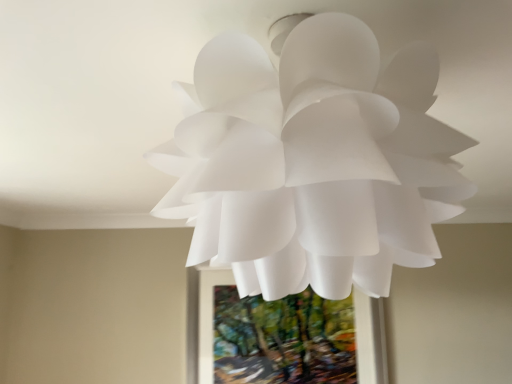
Question: Looking at the image, does white matte paper flower at center seem bigger or smaller compared to green textured painting at center?

Choices:
 (A) small
 (B) big

Answer: (B)

Question: From a real-world perspective, relative to green textured painting at center, is white matte paper flower at center vertically above or below?

Choices:
 (A) below
 (B) above

Answer: (B)

Question: In the image, is white matte paper flower at center on the left side or the right side of green textured painting at center?

Choices:
 (A) right
 (B) left

Answer: (B)

Question: From a real-world perspective, relative to white matte paper flower at center, is green textured painting at center vertically above or below?

Choices:
 (A) below
 (B) above

Answer: (A)

Question: Is green textured painting at center in front of or behind white matte paper flower at center in the image?

Choices:
 (A) front
 (B) behind

Answer: (B)

Question: Considering the positions of green textured painting at center and white matte paper flower at center in the image, is green textured painting at center bigger or smaller than white matte paper flower at center?

Choices:
 (A) small
 (B) big

Answer: (A)

Question: From the image's perspective, is green textured painting at center above or below white matte paper flower at center?

Choices:
 (A) above
 (B) below

Answer: (B)